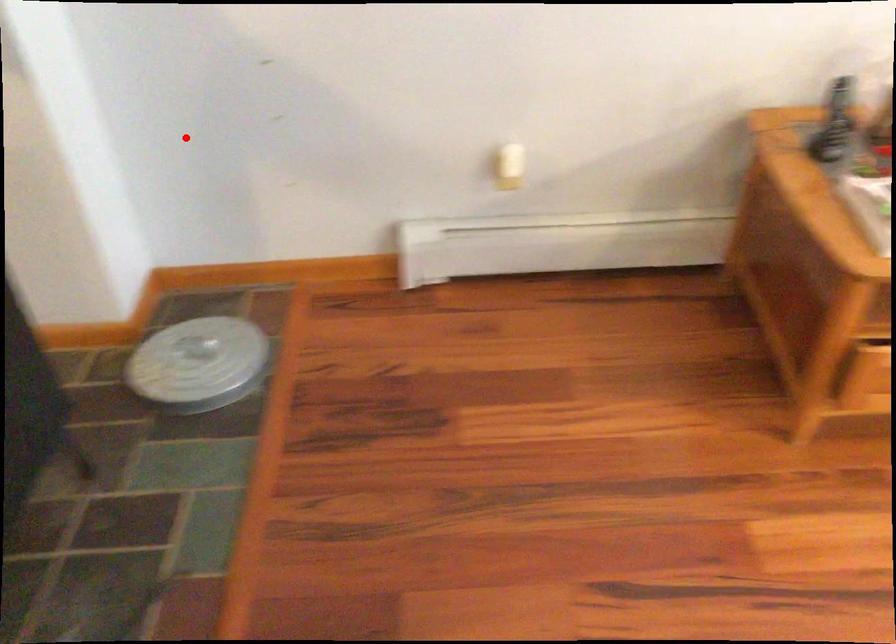
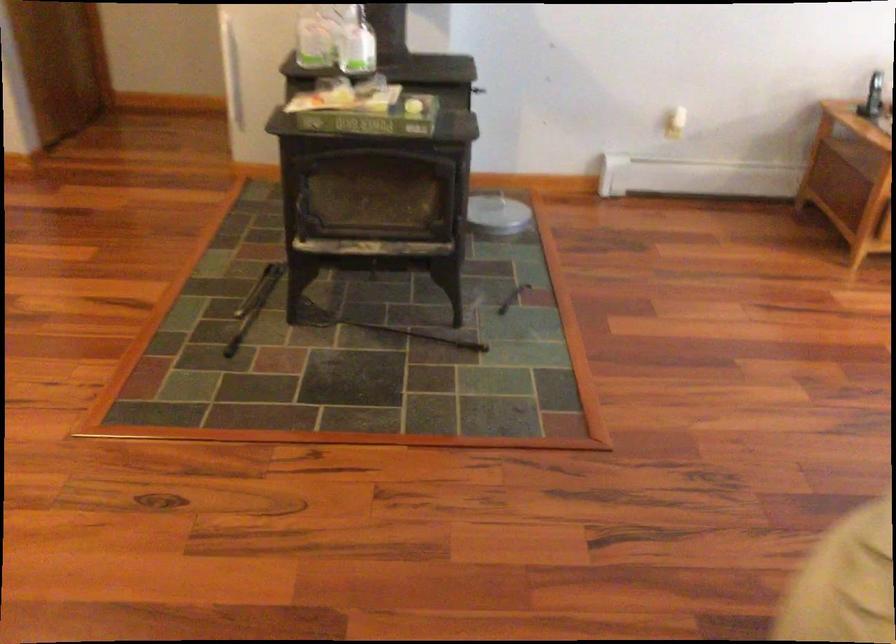
Question: I am providing you with two images of the same scene from different viewpoints. In image1, a red point is highlighted. Considering the same 3D point in image2, which of the following is correct?

Choices:
 (A) It is closer
 (B) It is farther

Answer: (B)